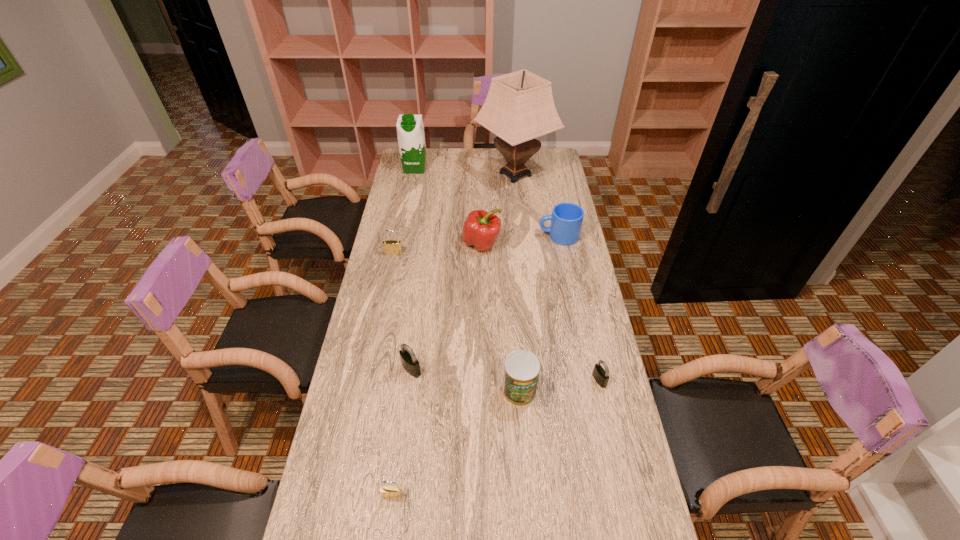
This screenshot has width=960, height=540. Identify the location of the rightmost padlock. (600, 375).

You are a GUI agent. You are given a task and a screenshot of the screen. Output one action in this format:
    pyautogui.click(x=<x>, y=<y>)
    Task: Click on the smaller black padlock
    
    Given the screenshot: What is the action you would take?
    pyautogui.click(x=600, y=375)

The height and width of the screenshot is (540, 960). I want to click on the nearest object, so click(388, 492).

Locate an element on the screen. the smaller brass padlock is located at coordinates (388, 492).

You are a GUI agent. You are given a task and a screenshot of the screen. Output one action in this format:
    pyautogui.click(x=<x>, y=<y>)
    Task: Click on the vacant area situated 0.310m on the left of the tallest object
    This screenshot has width=960, height=540.
    Given the screenshot: What is the action you would take?
    pyautogui.click(x=412, y=174)

You are a GUI agent. You are given a task and a screenshot of the screen. Output one action in this format:
    pyautogui.click(x=<x>, y=<y>)
    Task: Click on the vacant space located 0.170m on the front-facing side of the second tallest object
    The height and width of the screenshot is (540, 960).
    Given the screenshot: What is the action you would take?
    pyautogui.click(x=410, y=195)

I want to click on free spot located 0.120m on the right of the pepper, so click(531, 244).

The height and width of the screenshot is (540, 960). Identify the location of vacant region located on the front of the can. (523, 442).

Where is `free space located 0.190m on the side of the mug with the handle`? free space located 0.190m on the side of the mug with the handle is located at coordinates pos(492,236).

Locate an element on the screen. vacant point located 0.310m on the side of the mug with the handle is located at coordinates coord(464,236).